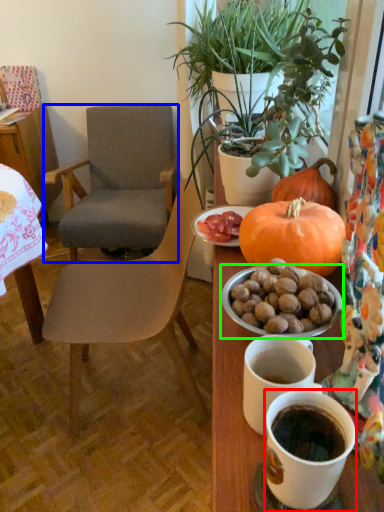
Question: Which object is positioned closest to coffee cup (highlighted by a red box)? Select from chair (highlighted by a blue box) and bowl (highlighted by a green box).

Choices:
 (A) chair
 (B) bowl

Answer: (B)